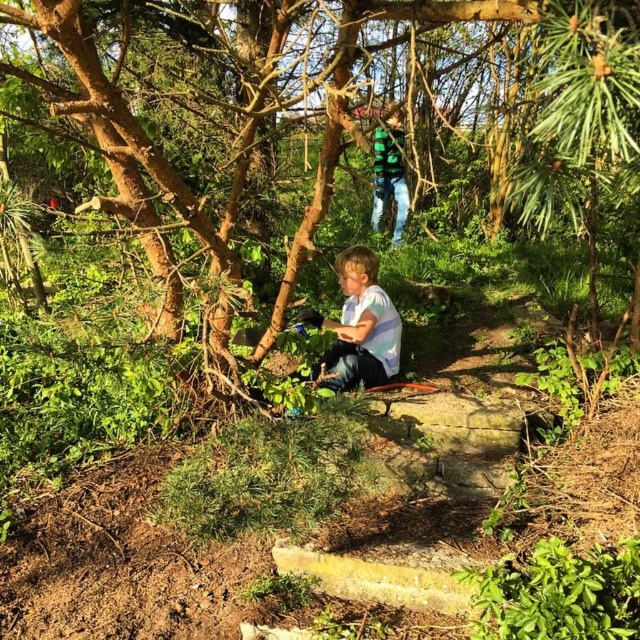
You are a visitor in the garden and want to locate the green striped shirt at upper center. According to the scene, where should you look relative to the brown rough tree at center?

The brown rough tree at center is below the green striped shirt at upper center, so you should look above the brown rough tree at center to find the green striped shirt at upper center.

You are standing in the garden scene and want to place a small flag at the closest point between point (364, 358) and point (372, 179). Which point should you choose?

Point (364, 358) is closer to the viewer than point (372, 179), so you should place the flag at point (364, 358).

You are standing at the center of the garden and want to locate the brown rough tree at center. Which direction should you look to find it?

The brown rough tree at center is located at point coordinates [234,125], so you should look towards the lower left direction from the center to find it.